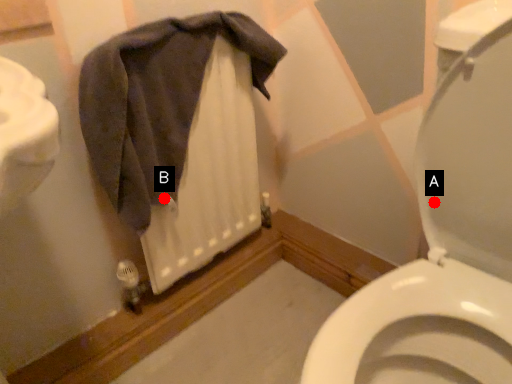
Question: Two points are circled on the image, labeled by A and B beside each circle. Which point appears farthest from the camera in this image?

Choices:
 (A) A is further
 (B) B is further

Answer: (B)